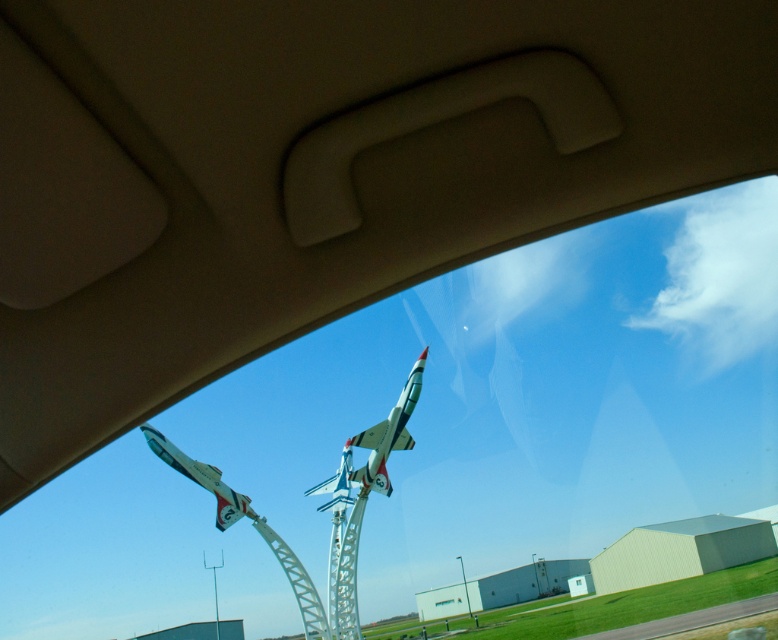
Which of these two, shiny metallic airplane at center or shiny metallic airplane at lower left, stands shorter?

shiny metallic airplane at lower left is shorter.

Does point (337, 493) come behind point (219, 508)?

Yes, point (337, 493) is behind point (219, 508).

Locate an element on the screen. This screenshot has height=640, width=778. shiny metallic airplane at center is located at coordinates (375, 445).